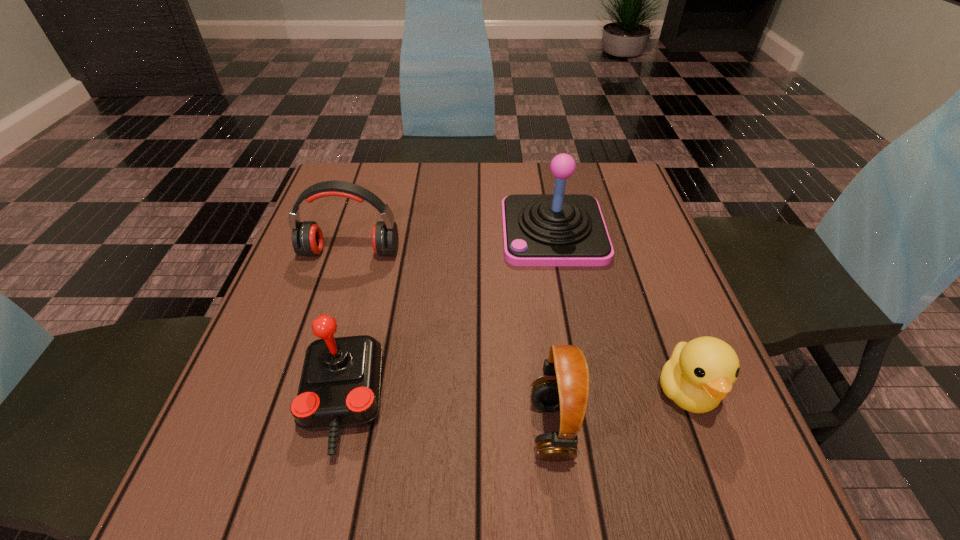
Where is `joystick located in the left edge section of the desktop`? The width and height of the screenshot is (960, 540). joystick located in the left edge section of the desktop is located at coordinates (339, 388).

The image size is (960, 540). What are the coordinates of `joystick located in the right edge section of the desktop` in the screenshot? It's located at (558, 229).

I want to click on duck positioned at the right edge, so click(699, 374).

What are the coordinates of `object located at the near left corner` in the screenshot? It's located at (339, 388).

This screenshot has width=960, height=540. What are the coordinates of `object situated at the far right corner` in the screenshot? It's located at (558, 229).

Where is `free space at the far edge of the desktop`? The width and height of the screenshot is (960, 540). free space at the far edge of the desktop is located at coordinates (456, 197).

This screenshot has height=540, width=960. Find the location of `vacant position at the near edge of the desktop`. vacant position at the near edge of the desktop is located at coordinates (572, 509).

In the image, there is a desktop. Identify the location of vacant space at the left edge. (262, 415).

Where is `vacant space at the right edge`? vacant space at the right edge is located at coordinates (660, 244).

Find the location of a particular element. The height and width of the screenshot is (540, 960). vacant space at the far left corner of the desktop is located at coordinates (339, 173).